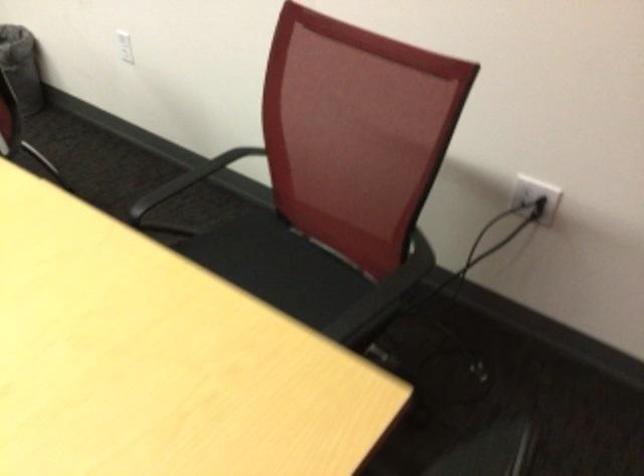
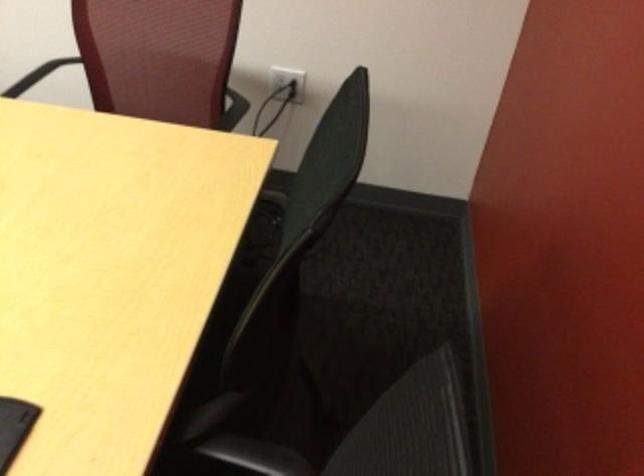
Where in the second image is the point corresponding to point 531,197 from the first image?

(288, 81)